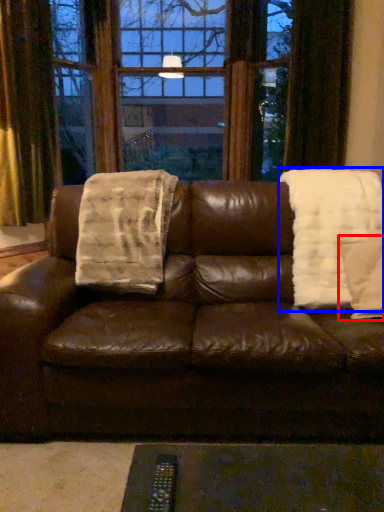
Question: Which object appears farthest to the camera in this image, throw pillow (highlighted by a red box) or blanket (highlighted by a blue box)?

Choices:
 (A) throw pillow
 (B) blanket

Answer: (B)